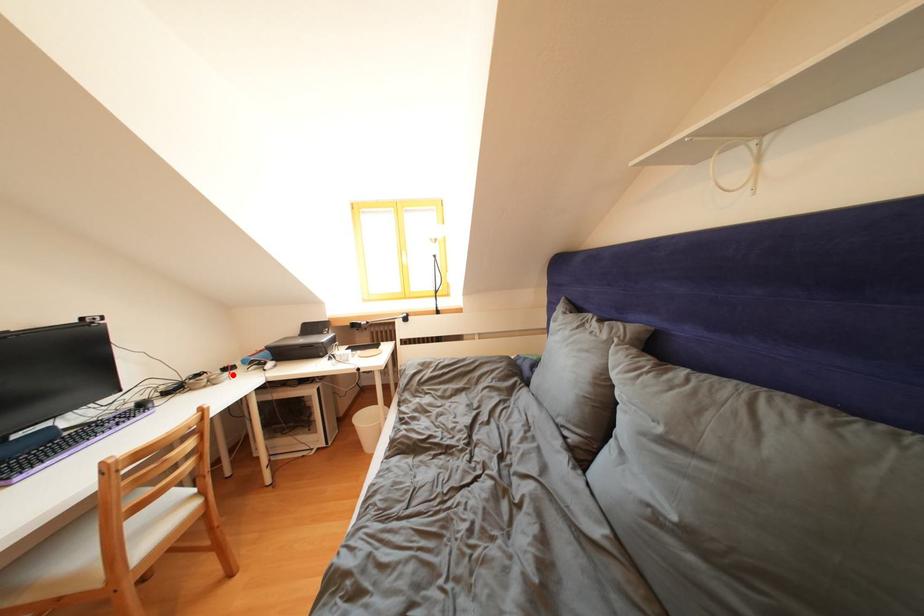
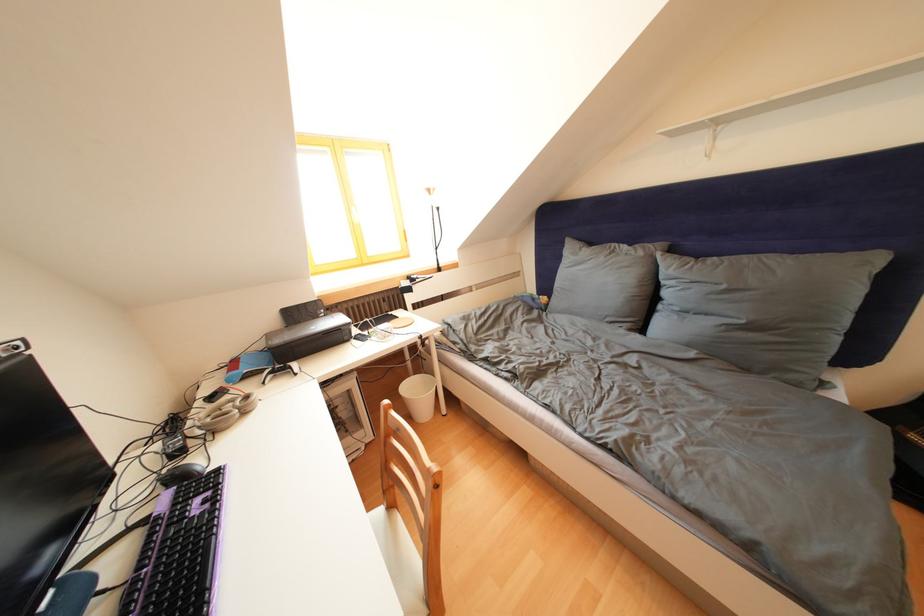
The point at the highlighted location is marked in the first image. Where is the corresponding point in the second image?

(220, 403)